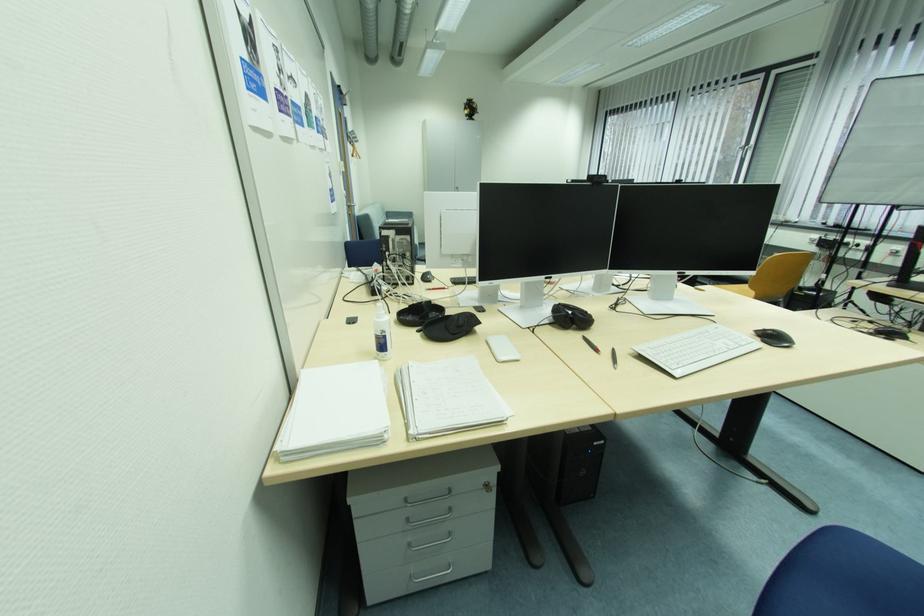
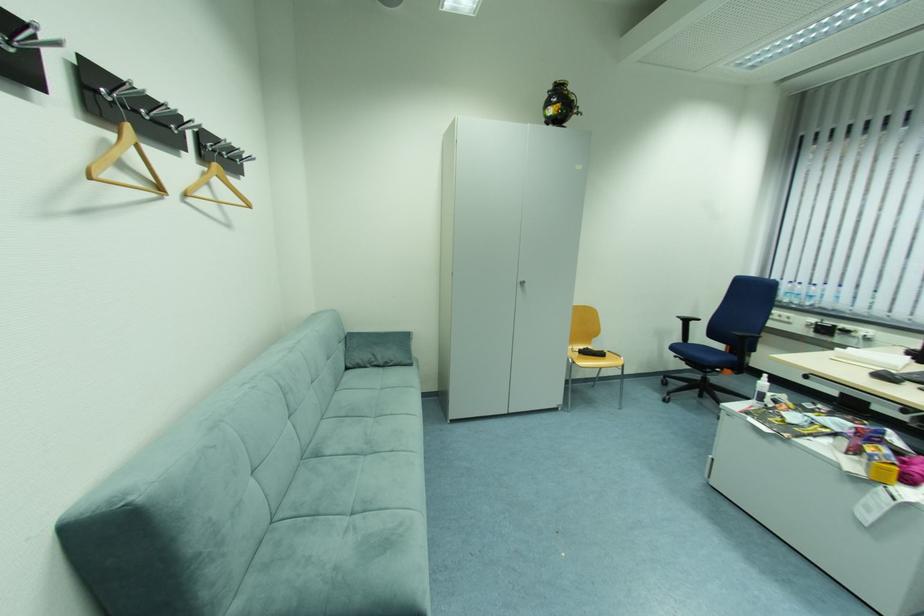
In the second image, find the point that corresponds to pixel 472 103 in the first image.

(558, 87)